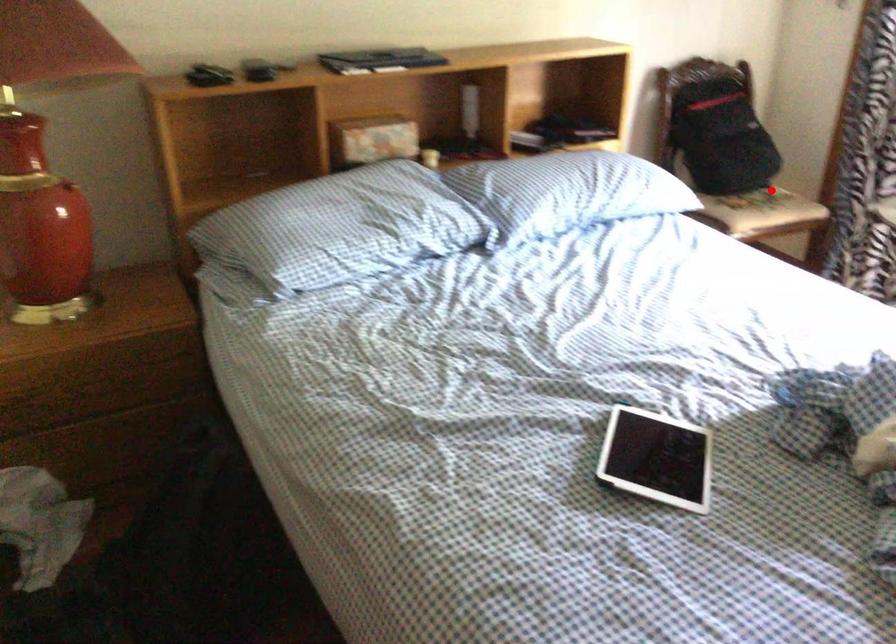
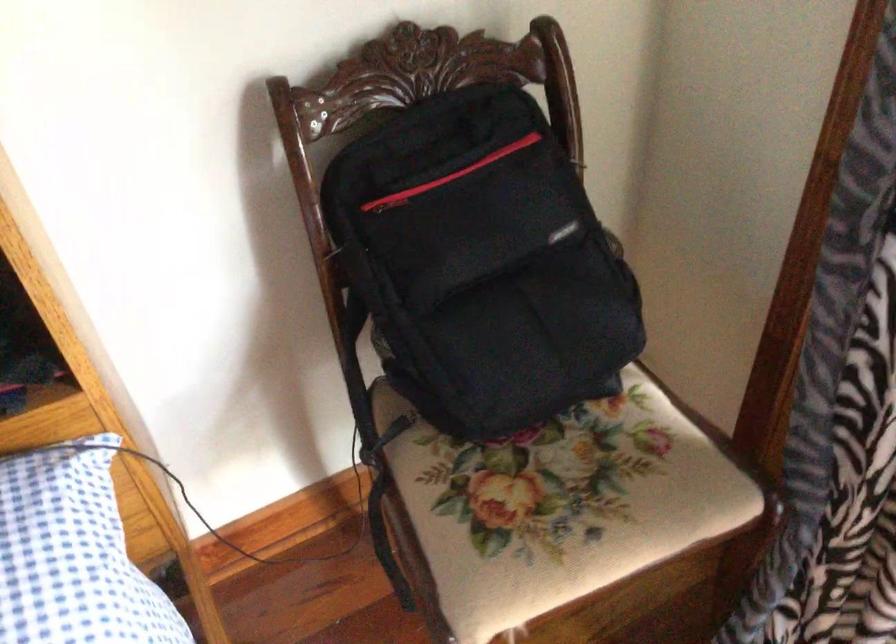
The point at the highlighted location is marked in the first image. Where is the corresponding point in the second image?

(556, 506)